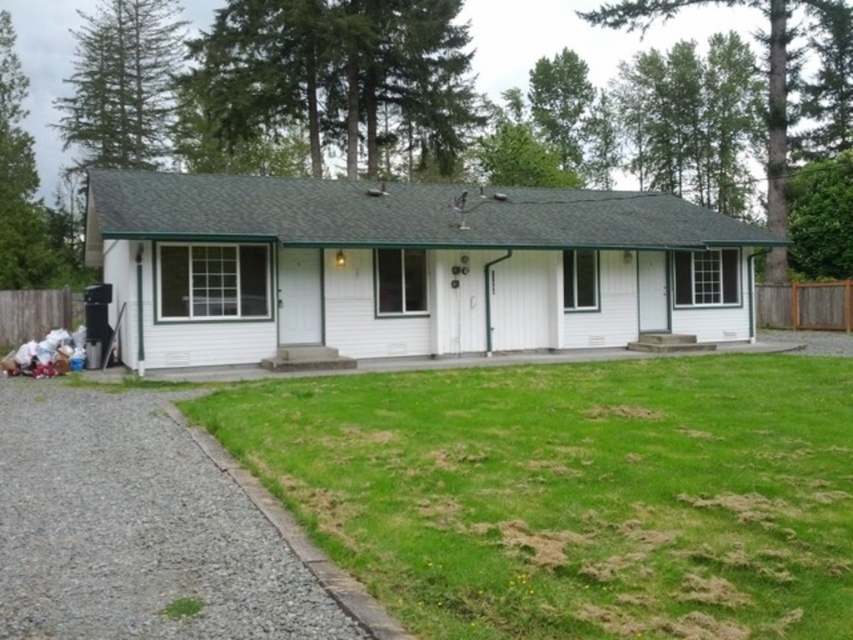
Does green grass at lower center lie behind gray gravel driveway at lower left?

No, it is in front of gray gravel driveway at lower left.

Does green grass at lower center come in front of gray gravel driveway at lower left?

That is True.

Is point (553, 616) closer to camera compared to point (12, 618)?

No.

You are a GUI agent. You are given a task and a screenshot of the screen. Output one action in this format:
    pyautogui.click(x=<x>, y=<y>)
    Task: Click on the green grass at lower center
    The image size is (853, 640).
    Given the screenshot: What is the action you would take?
    click(572, 492)

Can you confirm if white wood cottage at center is smaller than gray gravel driveway at lower left?

No, white wood cottage at center is not smaller than gray gravel driveway at lower left.

Does white wood cottage at center appear on the right side of gray gravel driveway at lower left?

Indeed, white wood cottage at center is positioned on the right side of gray gravel driveway at lower left.

Where is `white wood cottage at center`? This screenshot has height=640, width=853. white wood cottage at center is located at coordinates (405, 268).

This screenshot has height=640, width=853. What are the coordinates of `white wood cottage at center` in the screenshot? It's located at (405, 268).

Does green grass at lower center appear on the left side of white wood cottage at center?

Incorrect, green grass at lower center is not on the left side of white wood cottage at center.

Between green grass at lower center and white wood cottage at center, which one has more height?

Standing taller between the two is white wood cottage at center.

The width and height of the screenshot is (853, 640). Describe the element at coordinates (572, 492) in the screenshot. I see `green grass at lower center` at that location.

Where is `green grass at lower center`? Image resolution: width=853 pixels, height=640 pixels. green grass at lower center is located at coordinates (572, 492).